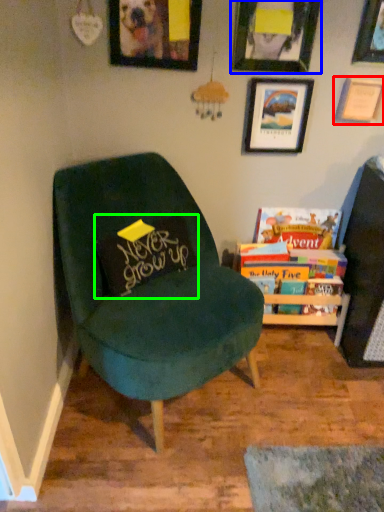
Question: Which object is the closest to the picture frame (highlighted by a red box)? Choose among these: picture frame (highlighted by a blue box) or pillow (highlighted by a green box).

Choices:
 (A) picture frame
 (B) pillow

Answer: (A)